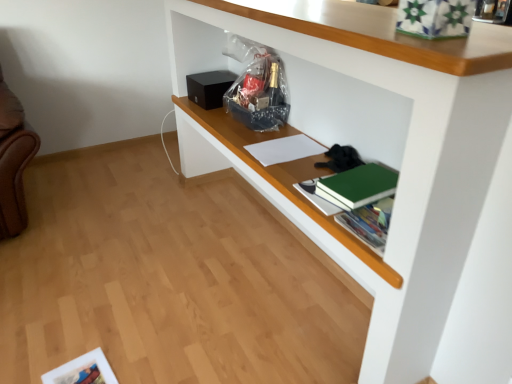
Question: Is white paper at center smaller than green matte book at center-right?

Choices:
 (A) yes
 (B) no

Answer: (A)

Question: Considering the relative sizes of white paper at center and green matte book at center-right in the image provided, is white paper at center thinner than green matte book at center-right?

Choices:
 (A) no
 (B) yes

Answer: (A)

Question: From a real-world perspective, is white paper at center positioned over green matte book at center-right based on gravity?

Choices:
 (A) no
 (B) yes

Answer: (A)

Question: Is white paper at center not near green matte book at center-right?

Choices:
 (A) yes
 (B) no

Answer: (B)

Question: Can you confirm if white paper at center is wider than green matte book at center-right?

Choices:
 (A) no
 (B) yes

Answer: (B)

Question: From a real-world perspective, is white matte shelf at upper center physically located above or below green matte book at center-right?

Choices:
 (A) above
 (B) below

Answer: (B)

Question: From their relative heights in the image, would you say white matte shelf at upper center is taller or shorter than green matte book at center-right?

Choices:
 (A) tall
 (B) short

Answer: (A)

Question: Looking at their shapes, would you say white matte shelf at upper center is wider or thinner than green matte book at center-right?

Choices:
 (A) thin
 (B) wide

Answer: (B)

Question: Considering their positions, is white matte shelf at upper center located in front of or behind green matte book at center-right?

Choices:
 (A) front
 (B) behind

Answer: (A)

Question: Is white paper at center inside or outside of white matte shelf at upper center?

Choices:
 (A) outside
 (B) inside

Answer: (B)

Question: In terms of width, does white paper at center look wider or thinner when compared to white matte shelf at upper center?

Choices:
 (A) wide
 (B) thin

Answer: (B)

Question: Considering their positions, is white paper at center located in front of or behind white matte shelf at upper center?

Choices:
 (A) behind
 (B) front

Answer: (A)

Question: Considering the positions of white paper at center and white matte shelf at upper center in the image, is white paper at center bigger or smaller than white matte shelf at upper center?

Choices:
 (A) small
 (B) big

Answer: (A)

Question: Considering the positions of point (360, 190) and point (350, 51), is point (360, 190) closer or farther from the camera than point (350, 51)?

Choices:
 (A) farther
 (B) closer

Answer: (A)

Question: Is green matte book at center-right in front of or behind white matte shelf at upper center in the image?

Choices:
 (A) front
 (B) behind

Answer: (B)